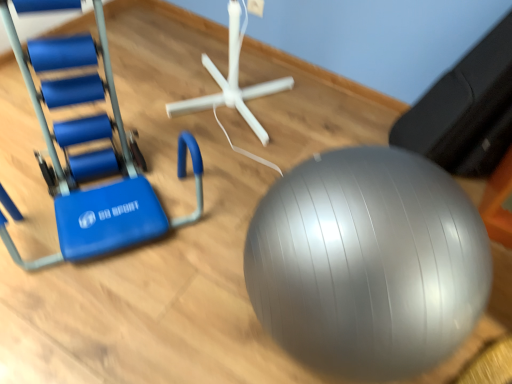
Locate an element on the screen. Image resolution: width=512 pixels, height=384 pixels. blank space to the left of silver rubber ball at center is located at coordinates (178, 297).